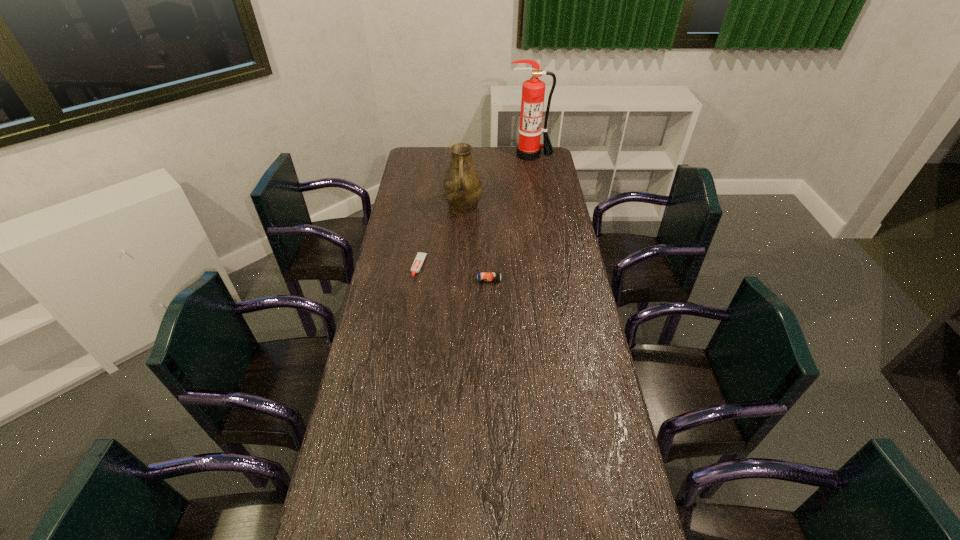
Locate an element on the screen. This screenshot has height=540, width=960. vacant area that lies between the rightmost object and the second tallest object is located at coordinates (496, 181).

Locate an element on the screen. free space that is in between the third tallest object and the third nearest object is located at coordinates (476, 244).

You are a GUI agent. You are given a task and a screenshot of the screen. Output one action in this format:
    pyautogui.click(x=<x>, y=<y>)
    Task: Click on the vacant space that's between the beer can and the rightmost object
    
    Given the screenshot: What is the action you would take?
    pyautogui.click(x=510, y=218)

Locate an element on the screen. the closest object to the shortest object is located at coordinates tap(481, 276).

Identify which object is the third closest to the tallest object. Please provide its 2D coordinates. Your answer should be formatted as a tuple, i.e. [(x, y)], where the tuple contains the x and y coordinates of a point satisfying the conditions above.

[(481, 276)]

Image resolution: width=960 pixels, height=540 pixels. What are the coordinates of `vacant space that satisfies the following two spatial constraints: 1. on the handle side of the second farthest object; 2. on the right side of the beer can` in the screenshot? It's located at (460, 280).

Find the location of `free space that satisfies the following two spatial constraints: 1. on the front side of the beer can; 2. on the right side of the toothpaste`. free space that satisfies the following two spatial constraints: 1. on the front side of the beer can; 2. on the right side of the toothpaste is located at coordinates (417, 280).